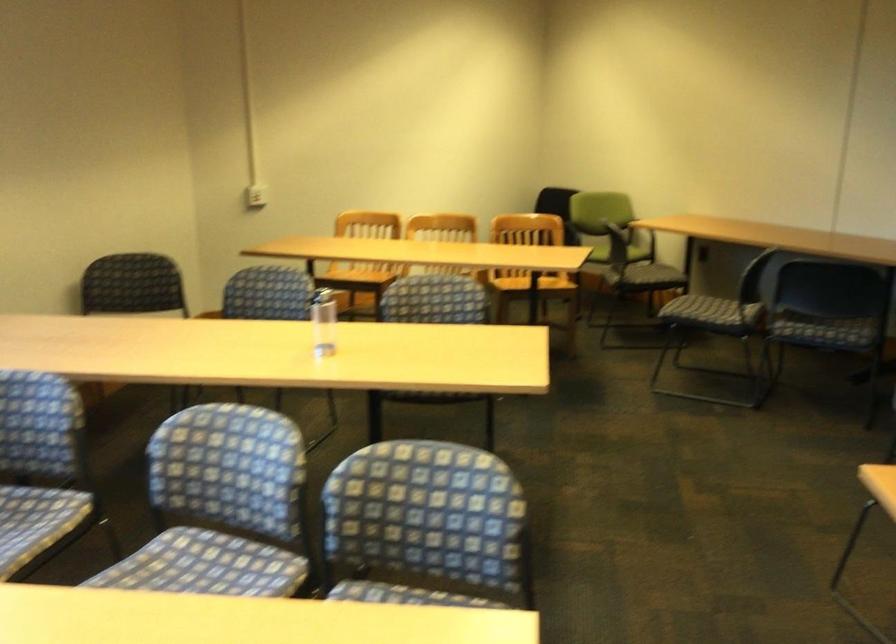
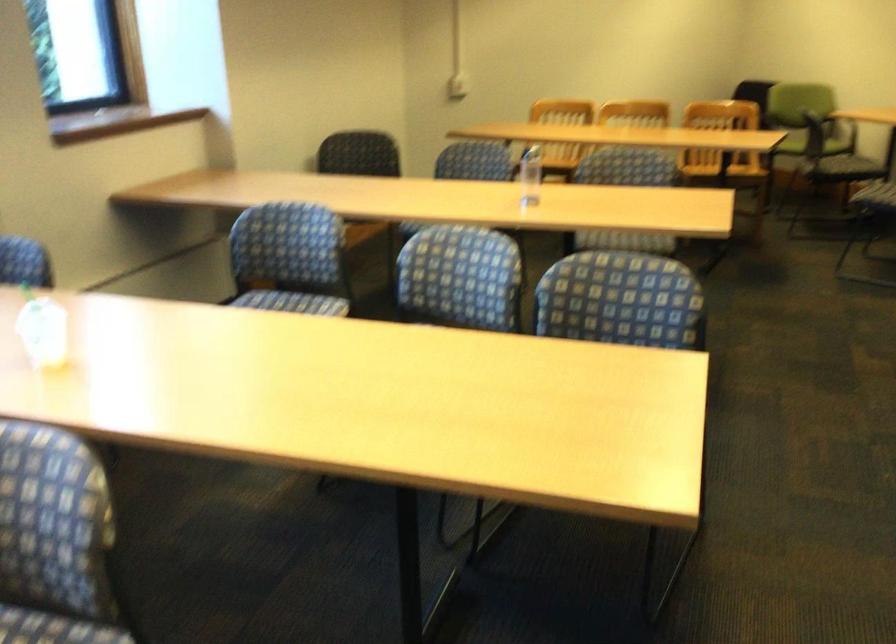
Find the pixel in the second image that matches point (229, 474) in the first image.

(460, 277)